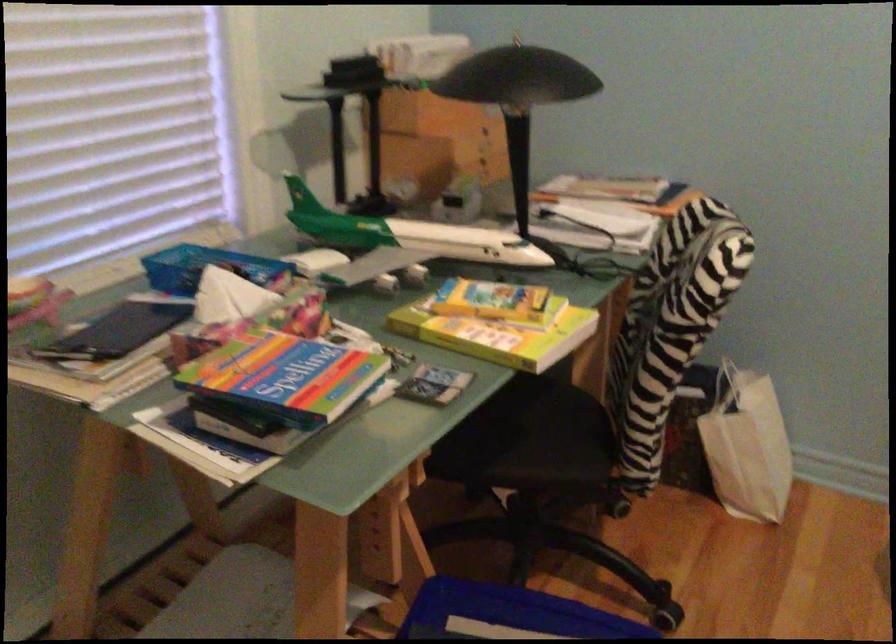
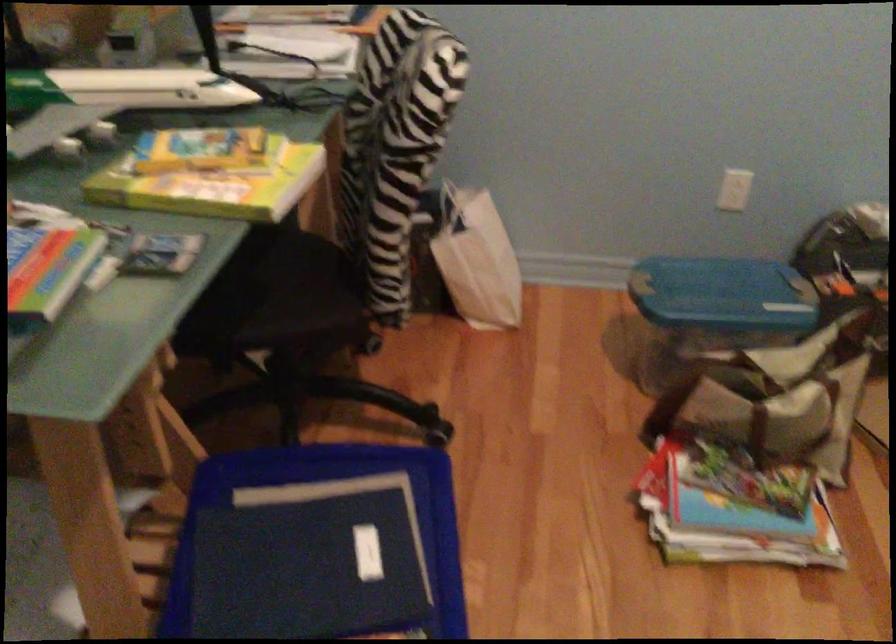
Question: The camera is either moving clockwise (left) or counter-clockwise (right) around the object. The first image is from the beginning of the video and the second image is from the end. Is the camera moving left or right when shooting the video?

Choices:
 (A) Left
 (B) Right

Answer: (A)